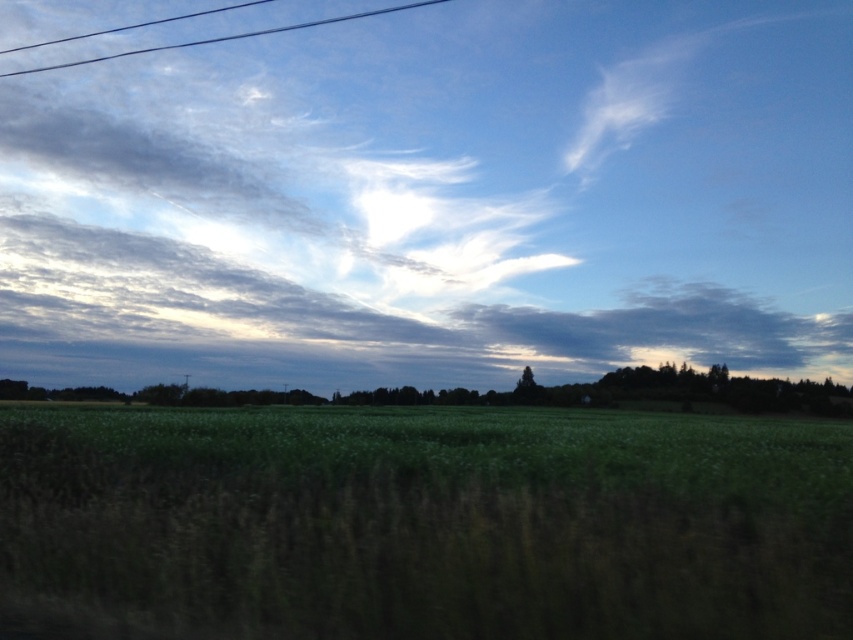
Question: Which point is farther to the camera?

Choices:
 (A) black wire at upper left
 (B) green grass at center

Answer: (A)

Question: From the image, what is the correct spatial relationship of green grass at center in relation to black wire at upper left?

Choices:
 (A) right
 (B) left

Answer: (A)

Question: Can you confirm if green grass at center is smaller than black wire at upper left?

Choices:
 (A) no
 (B) yes

Answer: (A)

Question: Which point is farther from the camera taking this photo?

Choices:
 (A) (532, 541)
 (B) (225, 38)

Answer: (B)

Question: Does green grass at center appear on the right side of black wire at upper left?

Choices:
 (A) no
 (B) yes

Answer: (B)